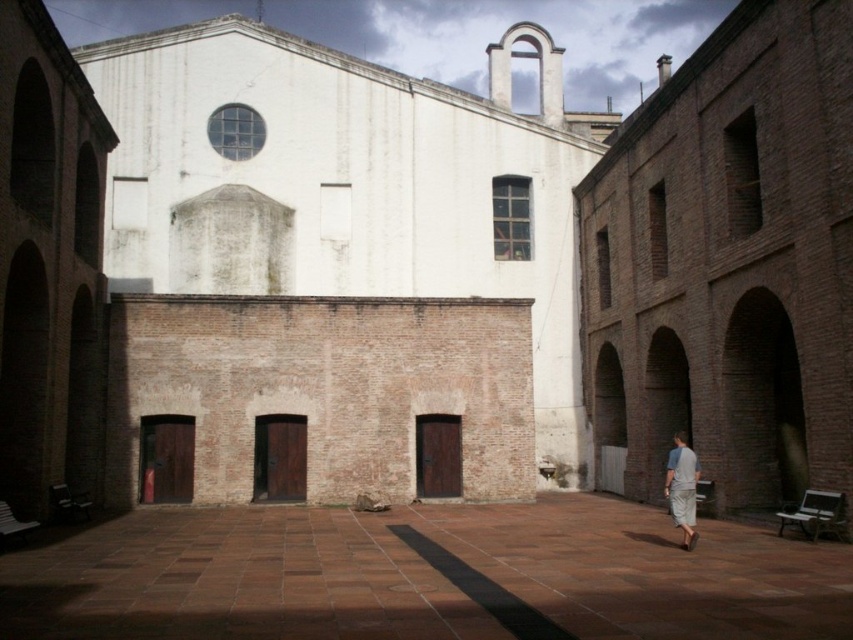
Question: Does white matte church at center have a smaller size compared to brown brick church at right?

Choices:
 (A) yes
 (B) no

Answer: (B)

Question: Which point is farther from the camera taking this photo?

Choices:
 (A) (674, 524)
 (B) (233, 211)
 (C) (712, 248)

Answer: (B)

Question: Can you confirm if brown brick church at right is positioned to the right of gray cotton shirt at lower right?

Choices:
 (A) yes
 (B) no

Answer: (A)

Question: Which of the following is the closest to the observer?

Choices:
 (A) brown brick church at right
 (B) brown stone courtyard at center
 (C) white matte church at center
 (D) gray cotton shirt at lower right

Answer: (B)

Question: Among these points, which one is farthest from the camera?

Choices:
 (A) (338, 221)
 (B) (694, 372)
 (C) (685, 500)

Answer: (A)

Question: Can you confirm if brown brick church at right is positioned above brown stone courtyard at center?

Choices:
 (A) no
 (B) yes

Answer: (B)